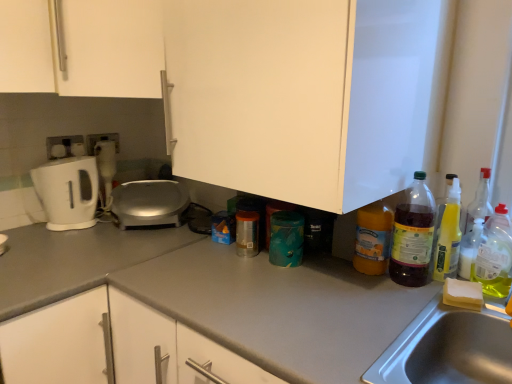
Identify the location of vacant space positioned to the left of translucent plastic bottle at right, which appears as the 4th bottle when viewed from the right. (347, 282).